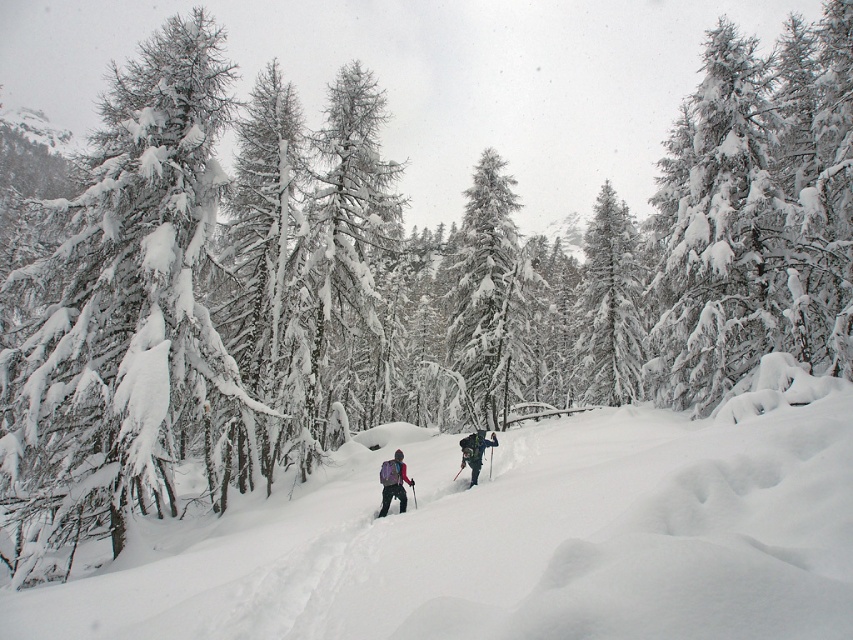
You are a hiker planning to place a small emergency kit on the ground near the matte purple backpack at center. The coordinates of the backpack are given as point (393, 483). If you want to place the kit 0.1 units to the right and 0.05 units below the backpack, what would be the new coordinates for the emergency kit?

The new coordinates for the emergency kit would be calculated by adding 0.1 to the x coordinate and subtracting 0.05 from the y coordinate of the matte purple backpack at center. Therefore, the new coordinates are 0.755 0.462 0.1 0.05 0.855 0.412.

You are planning to take a photo of the two items in the snowy forest scene. The matte purple backpack at center and the dark green jacket at center are both in the frame. Which item appears shorter in the photo?

The matte purple backpack at center appears shorter than the dark green jacket at center because the matte purple backpack at center is not as tall as dark green jacket at center.